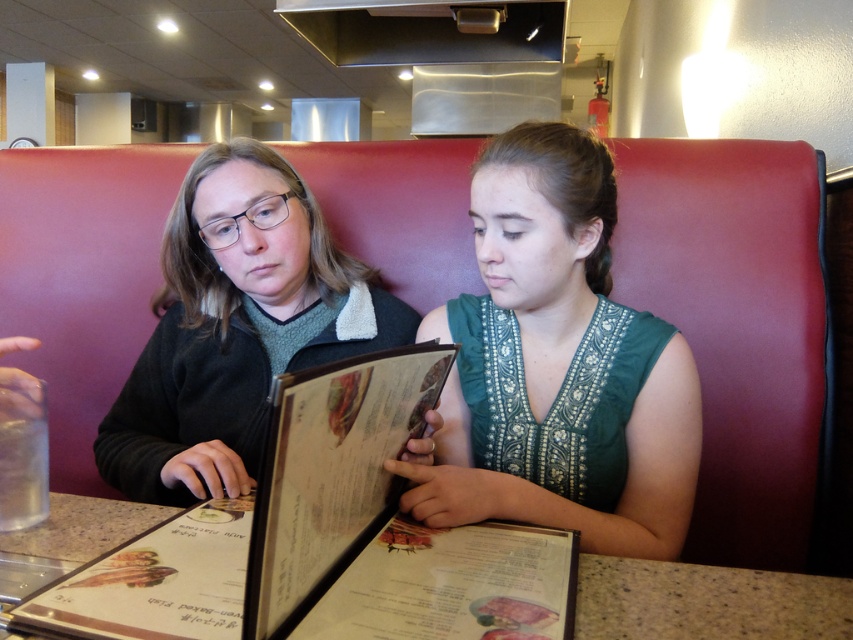
Question: Which object is positioned closest to the green fabric dress at center?

Choices:
 (A) matte black sweater at left
 (B) black matte menu at center

Answer: (B)

Question: Does matte black sweater at left lie in front of black matte menu at center?

Choices:
 (A) yes
 (B) no

Answer: (B)

Question: Is matte black sweater at left below black matte menu at center?

Choices:
 (A) no
 (B) yes

Answer: (A)

Question: Can you confirm if black matte menu at center is positioned below wooden table at center?

Choices:
 (A) yes
 (B) no

Answer: (B)

Question: Which point is farther to the camera?

Choices:
 (A) (677, 628)
 (B) (469, 472)

Answer: (B)

Question: Which of these objects is positioned closest to the black matte menu at center?

Choices:
 (A) wooden table at center
 (B) matte black sweater at left
 (C) green fabric dress at center

Answer: (C)